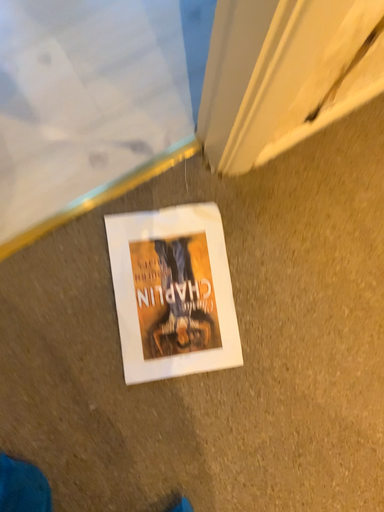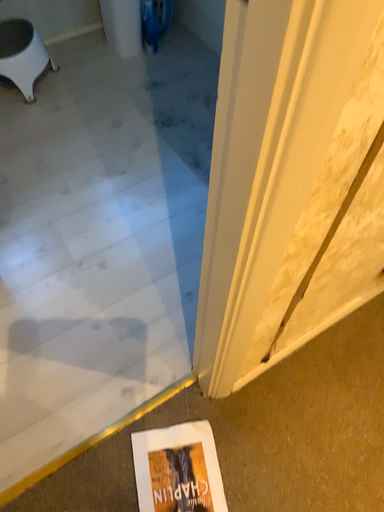
Question: Which way did the camera rotate in the video?

Choices:
 (A) rotated downward
 (B) rotated upward

Answer: (B)